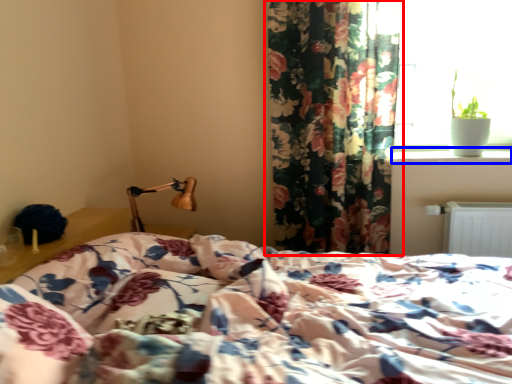
Question: Among these objects, which one is farthest to the camera, curtain (highlighted by a red box) or window sill (highlighted by a blue box)?

Choices:
 (A) curtain
 (B) window sill

Answer: (B)